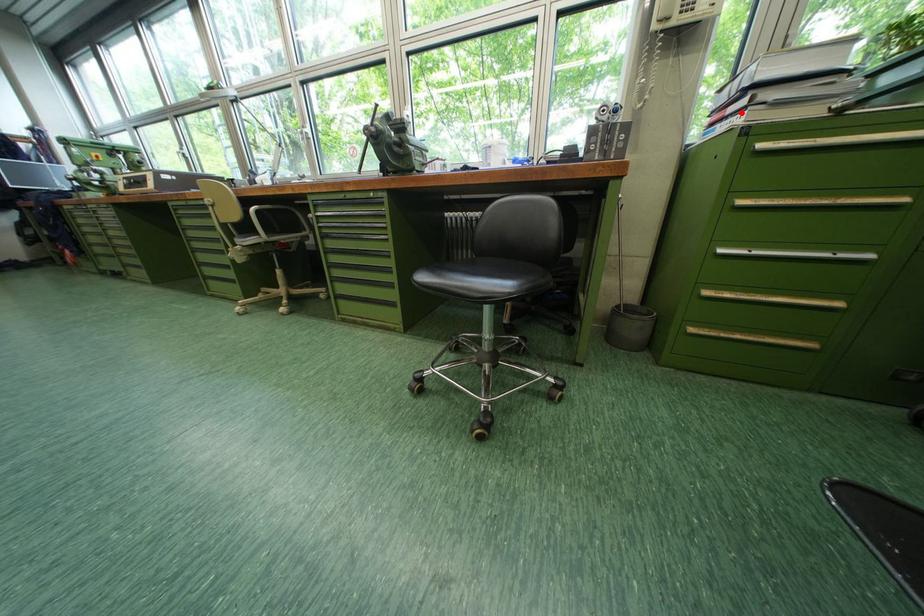
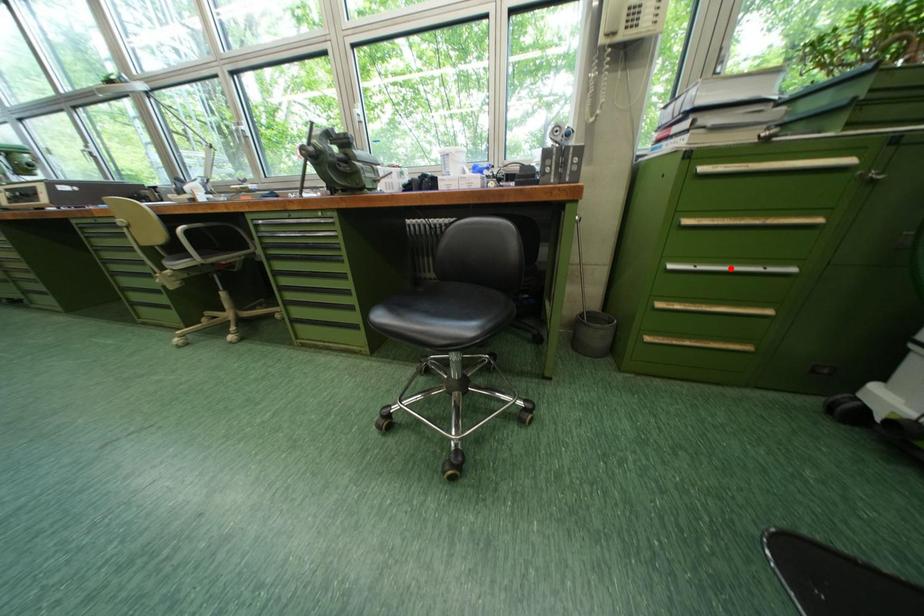
Based on the photo, I am providing you with two images of the same scene from different viewpoints. A red point is marked on the first image and another point is marked on the second image. Is the marked point in image1 the same physical position as the marked point in image2?

No